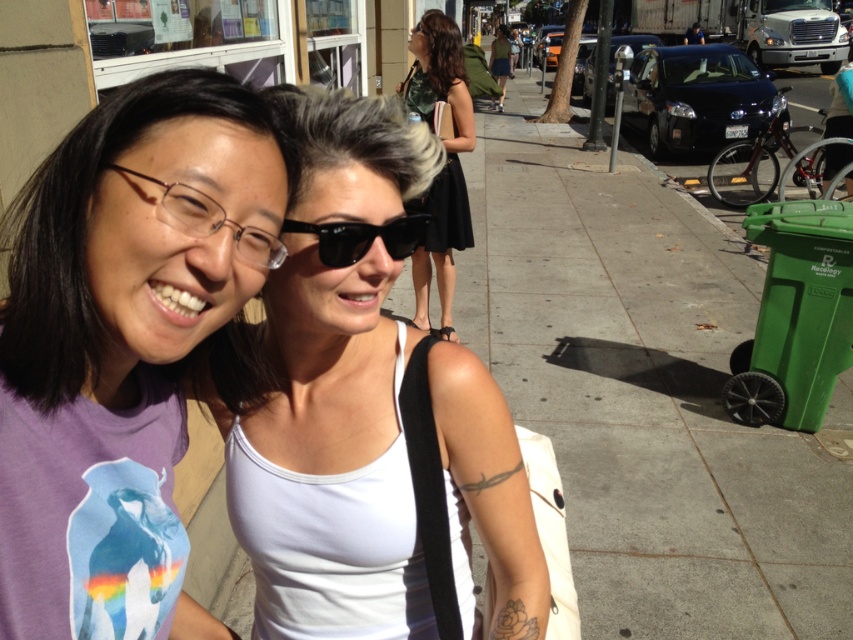
Which is more to the right, white matte tank top at center or green textured dress at upper center?

green textured dress at upper center

Is white matte tank top at center smaller than green textured dress at upper center?

Correct, white matte tank top at center occupies less space than green textured dress at upper center.

Does point (393, 276) lie in front of point (454, 216)?

Yes, point (393, 276) is closer to viewer.

Locate an element on the screen. white matte tank top at center is located at coordinates (361, 461).

Between green plastic trash can at right and purple matte t-shirt at center, which one appears on the left side from the viewer's perspective?

purple matte t-shirt at center

Does green plastic trash can at right appear under purple matte t-shirt at center?

Actually, green plastic trash can at right is above purple matte t-shirt at center.

You are a GUI agent. You are given a task and a screenshot of the screen. Output one action in this format:
    pyautogui.click(x=<x>, y=<y>)
    Task: Click on the green plastic trash can at right
    This screenshot has width=853, height=640.
    Given the screenshot: What is the action you would take?
    pyautogui.click(x=645, y=392)

The image size is (853, 640). I want to click on green plastic trash can at right, so click(645, 392).

Can you confirm if green textured dress at upper center is shorter than black plastic sunglasses at center?

In fact, green textured dress at upper center may be taller than black plastic sunglasses at center.

Does green textured dress at upper center appear on the right side of black plastic sunglasses at center?

Correct, you'll find green textured dress at upper center to the right of black plastic sunglasses at center.

Measure the distance between point (445,60) and camera.

Point (445,60) is 14.02 feet away from camera.

Identify the location of green textured dress at upper center. (445, 160).